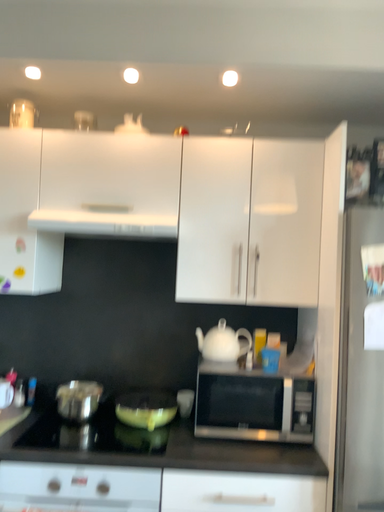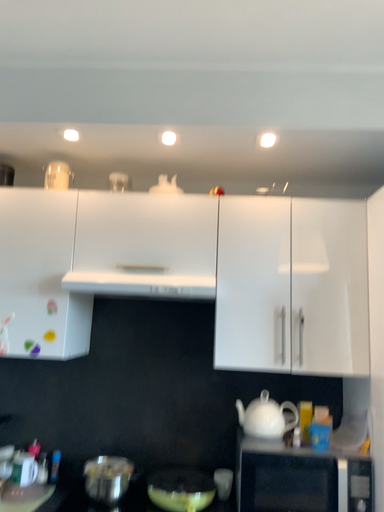
Question: Which way did the camera rotate in the video?

Choices:
 (A) rotated upward
 (B) rotated downward

Answer: (A)